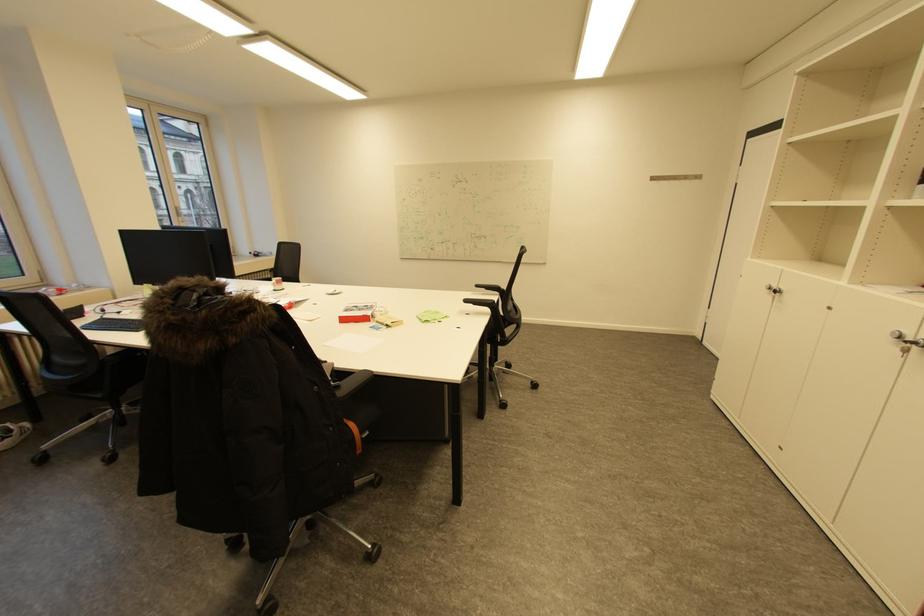
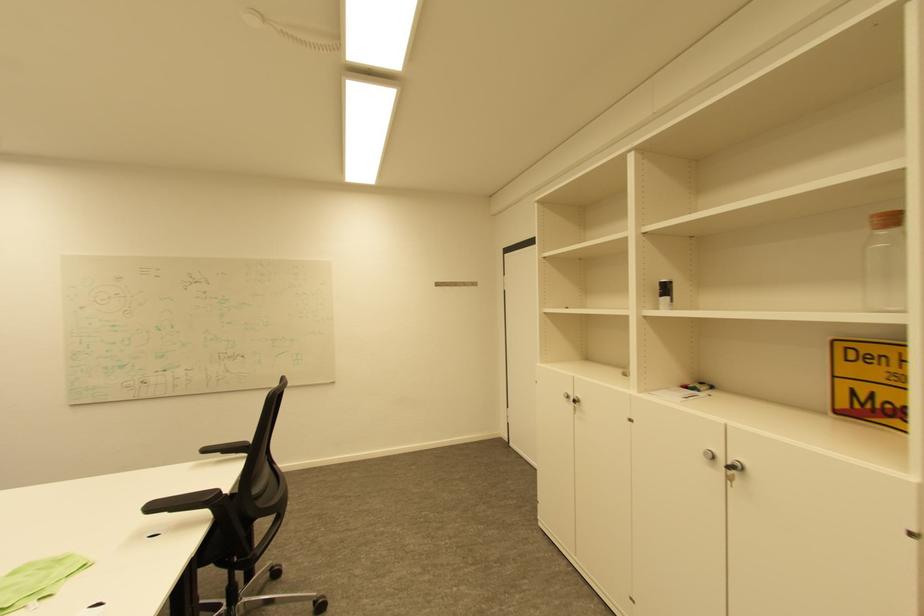
The point at (473, 302) is marked in the first image. Where is the corresponding point in the second image?

(159, 508)